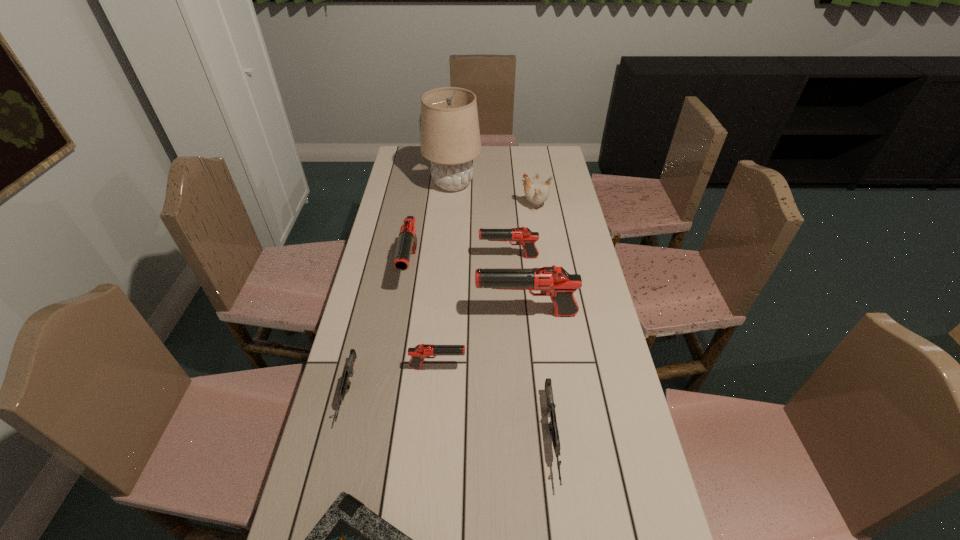
Find the location of a particular element. vacant region that satisfies the following two spatial constraints: 1. at the aiming end of the second smallest black gun; 2. at the aiming end of the fifth gun from right to left is located at coordinates (510, 268).

At what (x,y) coordinates should I click in order to perform the action: click on free space that satisfies the following two spatial constraints: 1. at the aiming end of the third biggest black gun; 2. at the aiming end of the second tallest gun. Please return your answer as a coordinate pair (x, y). The image size is (960, 540). Looking at the image, I should click on (510, 268).